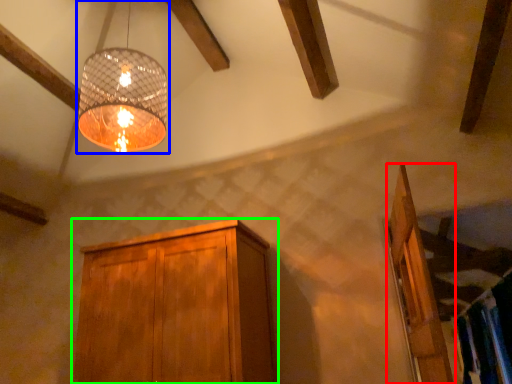
Question: Considering the real-world distances, which object is farthest from door (highlighted by a red box)? lamp (highlighted by a blue box) or cabinetry (highlighted by a green box)?

Choices:
 (A) lamp
 (B) cabinetry

Answer: (A)